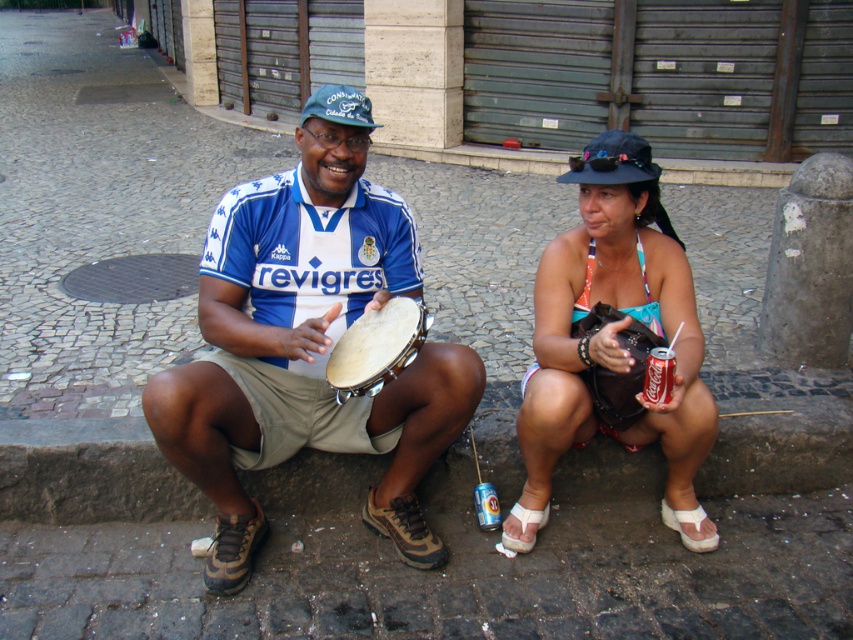
Question: Is teal bikini top at center below white fabric sandal at lower center?

Choices:
 (A) yes
 (B) no

Answer: (B)

Question: Can you confirm if teal bikini top at center is positioned to the right of white fabric sandal at lower right?

Choices:
 (A) no
 (B) yes

Answer: (A)

Question: Considering the relative positions of blue jersey tambourine at center and white fabric sandal at lower center in the image provided, where is blue jersey tambourine at center located with respect to white fabric sandal at lower center?

Choices:
 (A) above
 (B) below

Answer: (A)

Question: Which object is closer to the camera taking this photo?

Choices:
 (A) blue jersey tambourine at center
 (B) teal bikini top at center
 (C) light brown leather drum at center
 (D) white fabric sandal at lower center

Answer: (B)

Question: Among these points, which one is farthest from the camera?

Choices:
 (A) (415, 472)
 (B) (525, 541)
 (C) (663, 502)

Answer: (C)

Question: Which object is farther from the camera taking this photo?

Choices:
 (A) teal bikini top at center
 (B) white fabric sandal at lower right

Answer: (B)